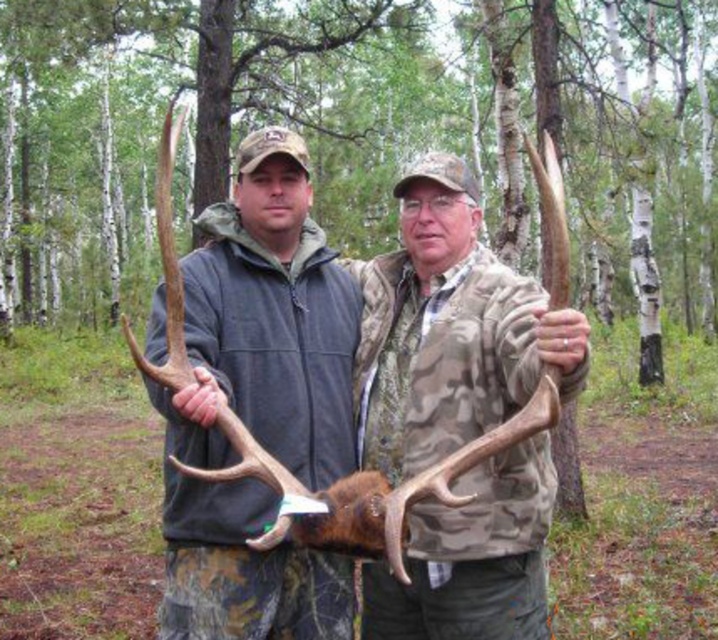
Question: Which of the following is the farthest from the observer?

Choices:
 (A) matte brown antlers at center
 (B) camouflage jacket at center

Answer: (B)

Question: Considering the relative positions of matte brown antlers at center and camo-patterned jacket at center in the image provided, where is matte brown antlers at center located with respect to camo-patterned jacket at center?

Choices:
 (A) right
 (B) left

Answer: (B)

Question: Which is nearer to the camouflage jacket at center?

Choices:
 (A) camo-patterned jacket at center
 (B) matte brown antlers at center

Answer: (B)

Question: Considering the real-world distances, which object is closest to the matte brown antlers at center?

Choices:
 (A) camo-patterned jacket at center
 (B) camouflage jacket at center

Answer: (B)

Question: Is matte brown antlers at center below camouflage jacket at center?

Choices:
 (A) no
 (B) yes

Answer: (A)

Question: Is matte brown antlers at center bigger than camo-patterned jacket at center?

Choices:
 (A) yes
 (B) no

Answer: (A)